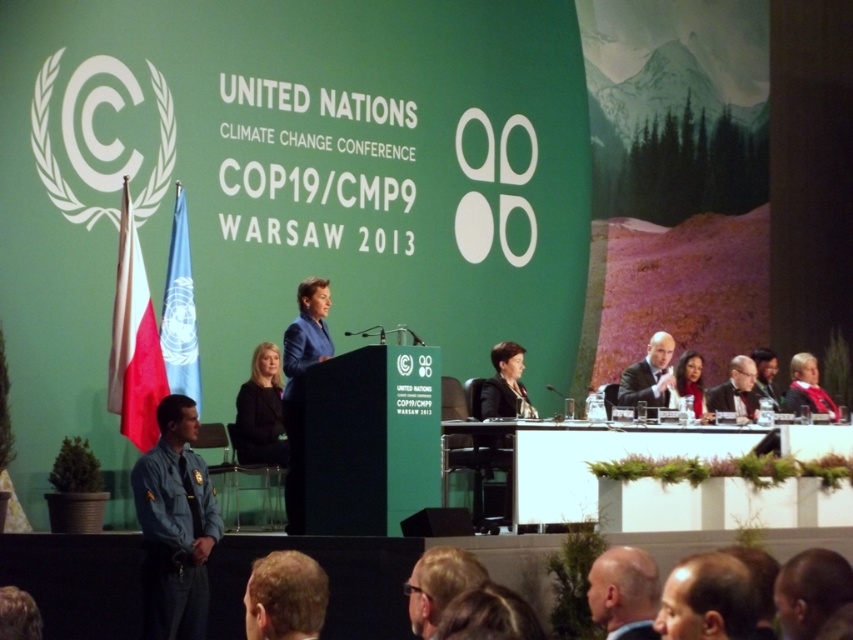
Consider the image. Is dark gray suit at center smaller than smooth skin face at center?

Correct, dark gray suit at center occupies less space than smooth skin face at center.

Is dark gray suit at center shorter than smooth skin face at center?

No.

Who is more distant from viewer, [630,376] or [689,392]?

Point [689,392]

Where is `dark gray suit at center`? This screenshot has width=853, height=640. dark gray suit at center is located at coordinates click(648, 374).

What do you see at coordinates (134, 340) in the screenshot? I see `polished white flag at left` at bounding box center [134, 340].

Is point (120, 273) farther from viewer compared to point (283, 349)?

Yes, it is.

Between point (148, 429) and point (294, 355), which one is positioned behind?

The point (148, 429) is more distant.

I want to click on polished white flag at left, so click(x=134, y=340).

Is bald head at lower center thinner than matte black suit at right?

Indeed, bald head at lower center has a lesser width compared to matte black suit at right.

Does bald head at lower center lie behind matte black suit at right?

No, bald head at lower center is closer to the viewer.

This screenshot has height=640, width=853. In order to click on bald head at lower center in this screenshot , I will do `click(622, 588)`.